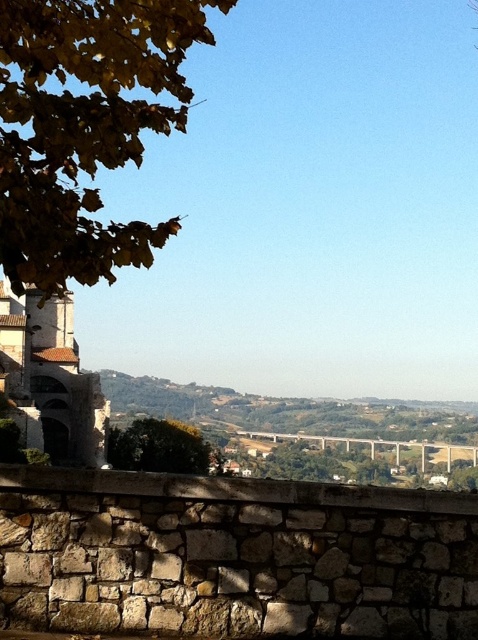
Can you confirm if yellow leafy branch at upper left is positioned to the left of green leafy tree at center?

No, yellow leafy branch at upper left is not to the left of green leafy tree at center.

Who is lower down, yellow leafy branch at upper left or green leafy tree at center?

Positioned lower is green leafy tree at center.

Does point (55, 188) come in front of point (151, 440)?

Yes, it is.

Identify the location of yellow leafy branch at upper left. [85, 128].